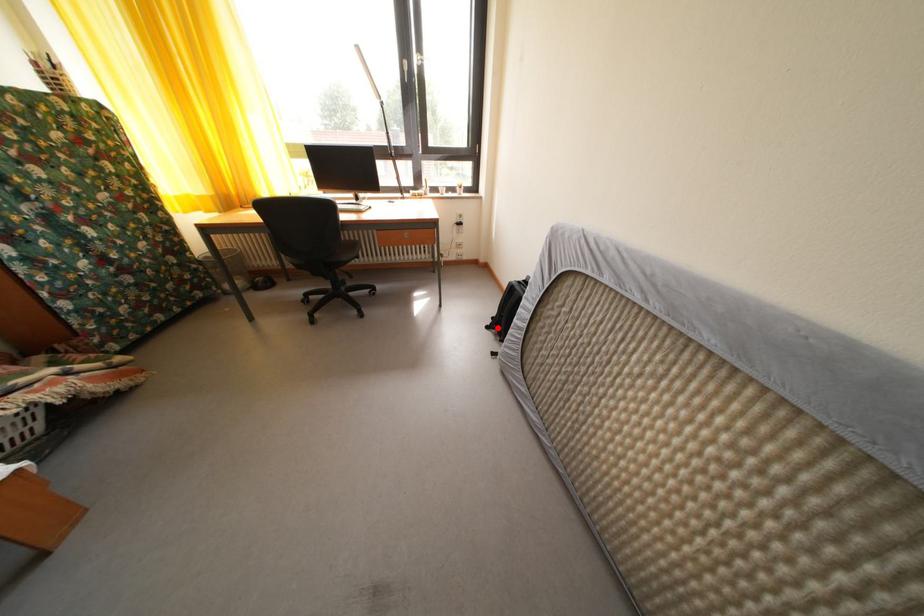
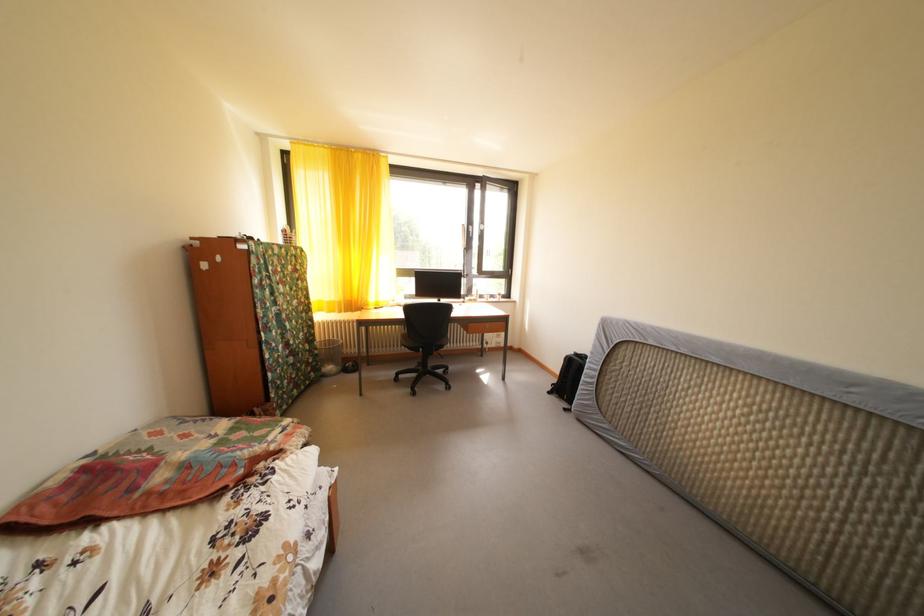
The point at the highlighted location is marked in the first image. Where is the corresponding point in the second image?

(558, 394)